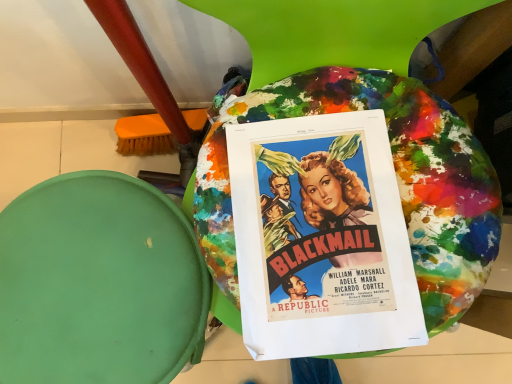
Question: From a real-world perspective, is vibrant paper poster at center physically located above or below paint splattered fabric bean bag at center?

Choices:
 (A) below
 (B) above

Answer: (B)

Question: In terms of width, does vibrant paper poster at center look wider or thinner when compared to paint splattered fabric bean bag at center?

Choices:
 (A) wide
 (B) thin

Answer: (B)

Question: Choose the correct answer: Is vibrant paper poster at center inside paint splattered fabric bean bag at center or outside it?

Choices:
 (A) outside
 (B) inside

Answer: (A)

Question: Which is correct: paint splattered fabric bean bag at center is inside vibrant paper poster at center, or outside of it?

Choices:
 (A) outside
 (B) inside

Answer: (A)

Question: From the image's perspective, relative to vibrant paper poster at center, is paint splattered fabric bean bag at center above or below?

Choices:
 (A) above
 (B) below

Answer: (B)

Question: From a real-world perspective, is paint splattered fabric bean bag at center positioned above or below vibrant paper poster at center?

Choices:
 (A) below
 (B) above

Answer: (A)

Question: Is point (74, 307) positioned closer to the camera than point (270, 304)?

Choices:
 (A) closer
 (B) farther

Answer: (B)